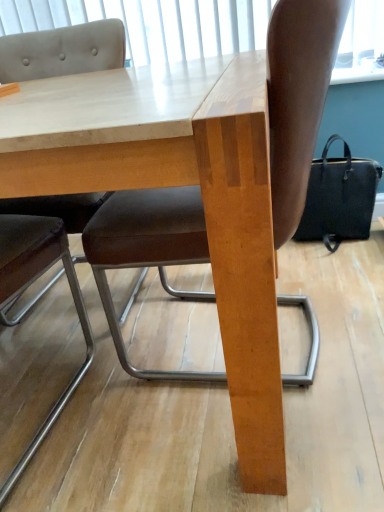
Locate an element on the screen. Image resolution: width=384 pixels, height=512 pixels. vacant area that is in front of black fabric bag at right is located at coordinates (365, 252).